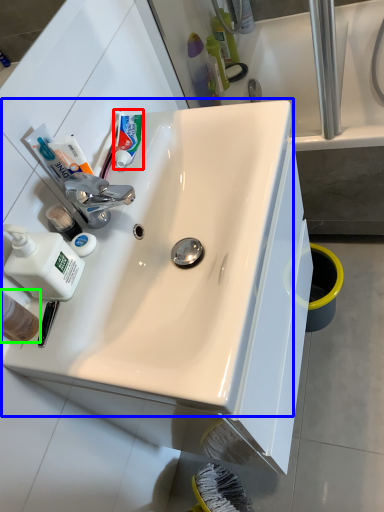
Question: Considering the real-world distances, which object is closest to toothpaste (highlighted by a red box)? sink (highlighted by a blue box) or mouthwash (highlighted by a green box).

Choices:
 (A) sink
 (B) mouthwash

Answer: (A)